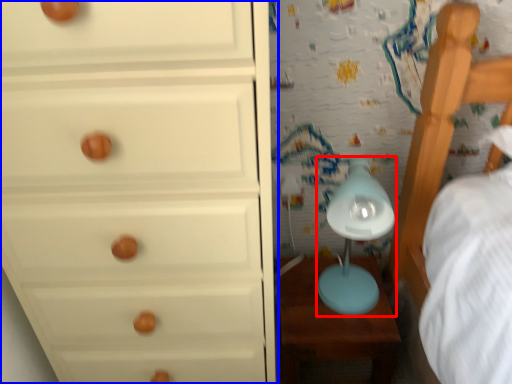
Question: Which object is further to the camera taking this photo, table lamp (highlighted by a red box) or chest of drawers (highlighted by a blue box)?

Choices:
 (A) table lamp
 (B) chest of drawers

Answer: (A)